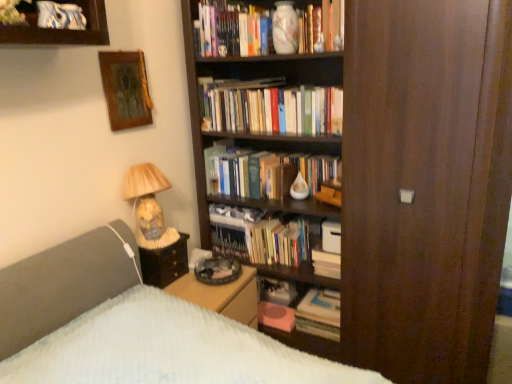
Question: Can you confirm if white matte paperback book at center is taller than wooden picture frame at upper left?

Choices:
 (A) no
 (B) yes

Answer: (A)

Question: Can you confirm if white matte paperback book at center is positioned to the left of wooden picture frame at upper left?

Choices:
 (A) no
 (B) yes

Answer: (A)

Question: From a real-world perspective, is white matte paperback book at center beneath wooden picture frame at upper left?

Choices:
 (A) no
 (B) yes

Answer: (B)

Question: Does white matte paperback book at center have a greater width compared to wooden picture frame at upper left?

Choices:
 (A) yes
 (B) no

Answer: (A)

Question: From the image's perspective, is white matte paperback book at center below wooden picture frame at upper left?

Choices:
 (A) yes
 (B) no

Answer: (A)

Question: Are white matte paperback book at center and wooden picture frame at upper left making contact?

Choices:
 (A) yes
 (B) no

Answer: (B)

Question: From the image's perspective, does wooden picture frame at upper left appear lower than matte glass lamp at left?

Choices:
 (A) yes
 (B) no

Answer: (B)

Question: Does wooden picture frame at upper left lie behind matte glass lamp at left?

Choices:
 (A) yes
 (B) no

Answer: (B)

Question: Considering the relative sizes of wooden picture frame at upper left and matte glass lamp at left in the image provided, is wooden picture frame at upper left wider than matte glass lamp at left?

Choices:
 (A) yes
 (B) no

Answer: (B)

Question: Is wooden picture frame at upper left bigger than matte glass lamp at left?

Choices:
 (A) no
 (B) yes

Answer: (A)

Question: Is wooden picture frame at upper left taller than matte glass lamp at left?

Choices:
 (A) yes
 (B) no

Answer: (B)

Question: Can you confirm if wooden picture frame at upper left is positioned to the left of matte glass lamp at left?

Choices:
 (A) yes
 (B) no

Answer: (A)

Question: From a real-world perspective, is wooden picture frame at upper left physically above white matte paperback book at center?

Choices:
 (A) no
 (B) yes

Answer: (B)